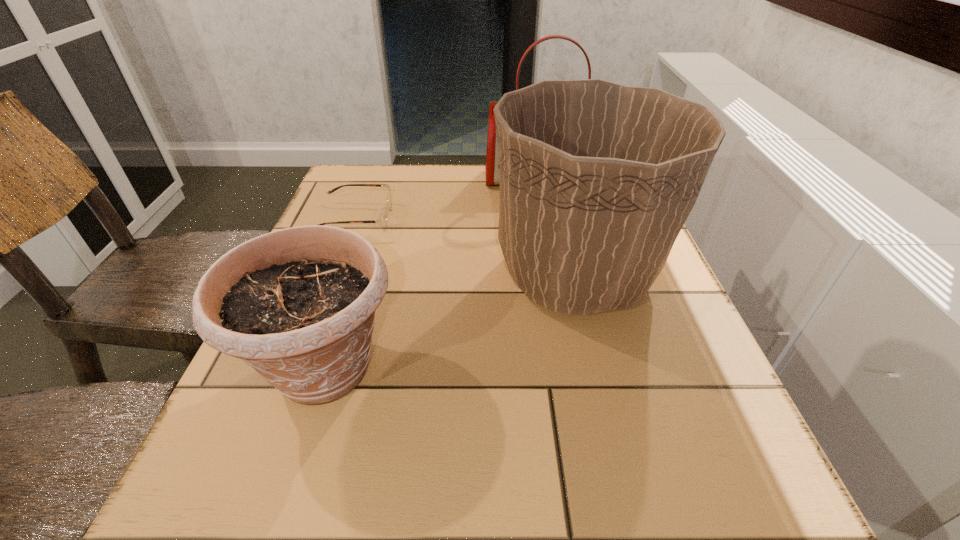
Find the location of a particular element. handbag is located at coordinates (492, 167).

The image size is (960, 540). I want to click on the right flowerpot, so click(597, 179).

I want to click on the left flowerpot, so click(298, 305).

Find the location of a particular element. The height and width of the screenshot is (540, 960). the shorter flowerpot is located at coordinates (298, 305).

The height and width of the screenshot is (540, 960). I want to click on spectacles, so click(x=382, y=220).

Locate an element on the screen. free space located 0.230m on the left of the farthest object is located at coordinates (401, 179).

At what (x,y) coordinates should I click in order to perform the action: click on vacant space situated 0.190m on the left of the right flowerpot. Please return your answer as a coordinate pair (x, y). The width and height of the screenshot is (960, 540). Looking at the image, I should click on (397, 274).

Identify the location of free location located 0.140m on the right of the shorter flowerpot. The image size is (960, 540). (487, 368).

Locate an element on the screen. The width and height of the screenshot is (960, 540). free location located 0.320m on the front-facing side of the spectacles is located at coordinates (525, 219).

I want to click on handbag at the far edge, so click(492, 167).